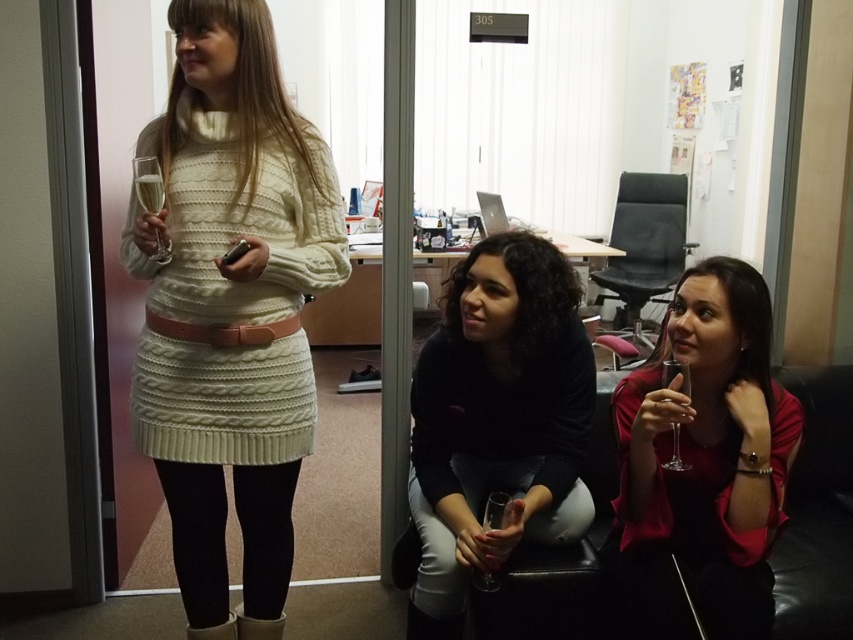
The width and height of the screenshot is (853, 640). I want to click on white knitted dress at center, so click(x=241, y=227).

Does white knitted dress at center appear over clear glass at upper left?

Incorrect, white knitted dress at center is not positioned above clear glass at upper left.

Between point (292, 228) and point (160, 182), which one is positioned behind?

Point (292, 228)

I want to click on white knitted dress at center, so click(x=241, y=227).

Is white knitted dress at center to the left of matte red dress at lower right from the viewer's perspective?

Yes, white knitted dress at center is to the left of matte red dress at lower right.

Who is more forward, (338, 246) or (679, 330)?

Positioned in front is point (679, 330).

Image resolution: width=853 pixels, height=640 pixels. Identify the location of white knitted dress at center. (241, 227).

Which is more to the left, white knitted dress at center or black matte shirt at center?

Positioned to the left is white knitted dress at center.

Who is more forward, [277,236] or [554,536]?

Point [277,236] is in front.

I want to click on white knitted dress at center, so click(x=241, y=227).